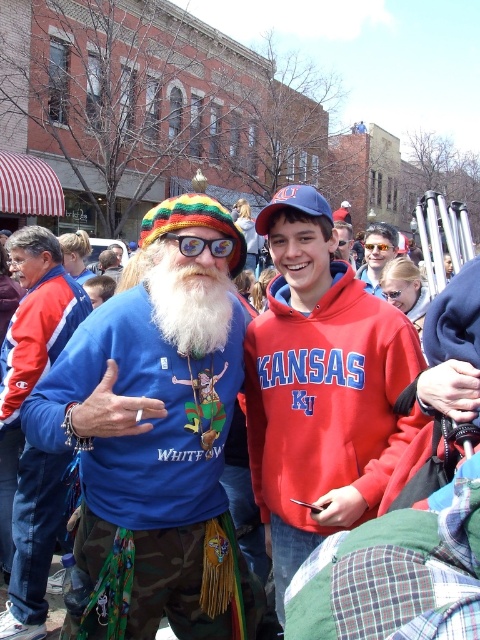
Is red fleece hoodie at center to the right of matte sunglasses at center from the viewer's perspective?

Incorrect, red fleece hoodie at center is not on the right side of matte sunglasses at center.

Does point (273, 477) come behind point (379, 236)?

No.

The width and height of the screenshot is (480, 640). What are the coordinates of `red fleece hoodie at center` in the screenshot? It's located at (321, 387).

Does red fleece hoodie at center have a larger size compared to multicolored plastic goggles at center?

Yes.

Which of these two, red fleece hoodie at center or multicolored plastic goggles at center, stands shorter?

Standing shorter between the two is multicolored plastic goggles at center.

What do you see at coordinates (321, 387) in the screenshot?
I see `red fleece hoodie at center` at bounding box center [321, 387].

At what (x,y) coordinates should I click in order to perform the action: click on red fleece hoodie at center. Please return your answer as a coordinate pair (x, y). This screenshot has height=640, width=480. Looking at the image, I should click on (321, 387).

Does point (375, 276) come behind point (200, 240)?

That is True.

This screenshot has height=640, width=480. Describe the element at coordinates (376, 253) in the screenshot. I see `matte sunglasses at center` at that location.

Where is `matte sunglasses at center`? The width and height of the screenshot is (480, 640). matte sunglasses at center is located at coordinates (376, 253).